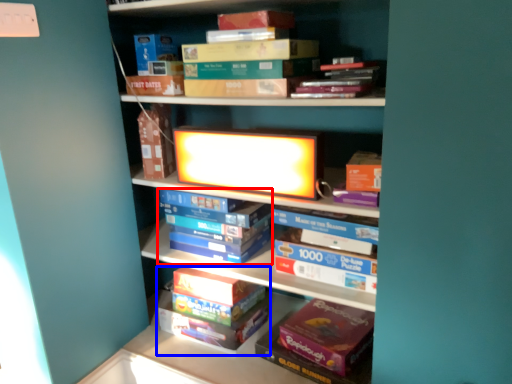
Question: Among these objects, which one is nearest to the camera, book (highlighted by a red box) or book (highlighted by a blue box)?

Choices:
 (A) book
 (B) book

Answer: (A)